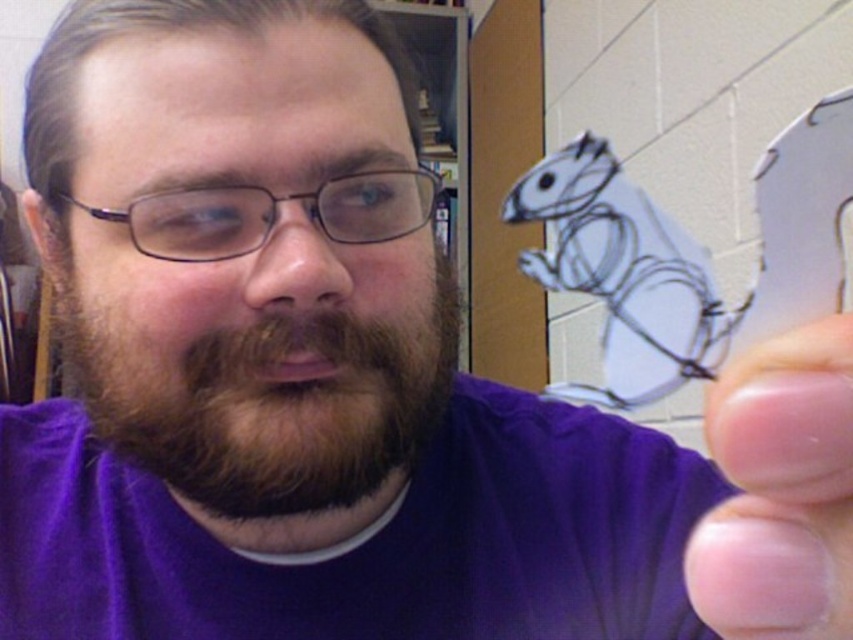
You are a photographer trying to capture the transparent plastic hand at right and the white paper squirrel at upper center in a single frame. Based on their sizes, which object should you focus on first to ensure both are in focus?

The transparent plastic hand at right is smaller than the white paper squirrel at upper center, so focusing on the white paper squirrel at upper center first would help ensure both are in focus since it is larger and easier to target.

You are a photographer trying to capture the exact location of the point marked at coordinates (276, 403) in the image. Based on the scene description, where would this point be located?

The point marked at coordinates (276, 403) is located on the brownwoollybeard at center.